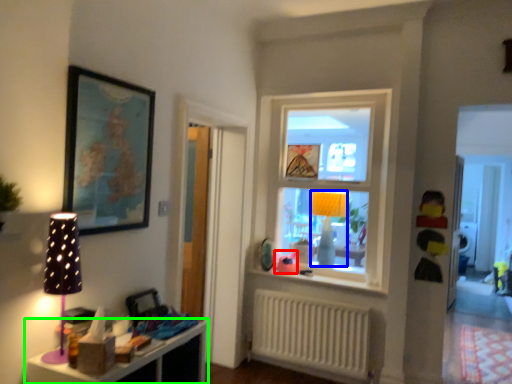
Question: Considering the real-world distances, which object is closest to toy (highlighted by a red box)? table lamp (highlighted by a blue box) or shelf (highlighted by a green box).

Choices:
 (A) table lamp
 (B) shelf

Answer: (A)